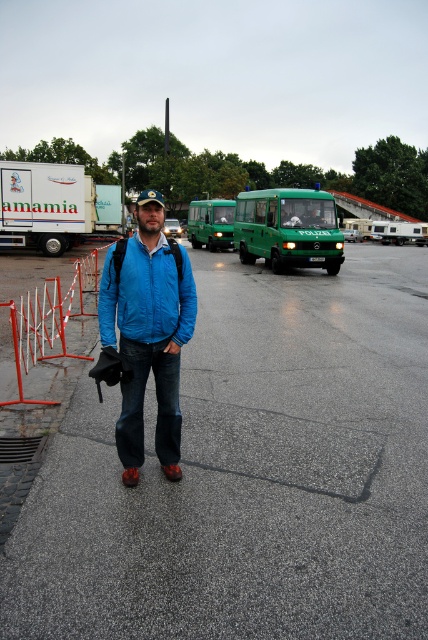
You are a pedestrian standing at the edge of the paved area. You see the blue matte jacket at center and the green matte bus at center. Which object is closer to you?

The blue matte jacket at center is closer to you because it is in front of the green matte bus at center.

You are a pedestrian standing at the edge of the paved area. You see the blue matte jacket at center and the white matte truck at left. Which object is closer to you?

The blue matte jacket at center is closer to you because it is in front of the white matte truck at left.